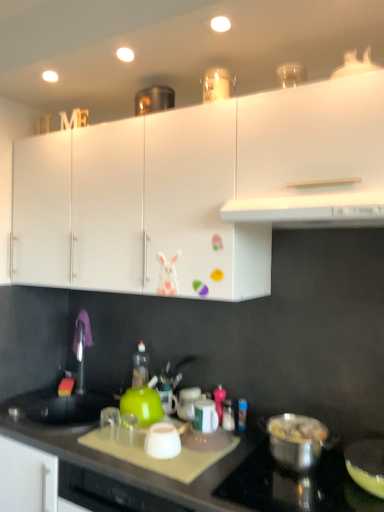
Image resolution: width=384 pixels, height=512 pixels. What do you see at coordinates (162, 441) in the screenshot?
I see `white glossy cup at center, which appears as the second kitchen appliance when viewed from the left` at bounding box center [162, 441].

At what (x,y) coordinates should I click in order to perform the action: click on stainless steel pot at lower right. Please return your answer as a coordinate pair (x, y). Image resolution: width=384 pixels, height=512 pixels. Looking at the image, I should click on (295, 485).

Describe the element at coordinates (198, 209) in the screenshot. The image size is (384, 512). I see `white matte cabinet at center, placed as the 2th cabinetry when sorted from right to left` at that location.

Measure the distance between point (192,389) and camera.

The distance of point (192,389) from camera is 6.27 feet.

What do you see at coordinates (188, 403) in the screenshot? This screenshot has height=512, width=384. I see `white glossy jar at center` at bounding box center [188, 403].

Measure the distance between point (209, 405) and camera.

Point (209, 405) is 1.65 meters away from camera.

This screenshot has height=512, width=384. Describe the element at coordinates (205, 416) in the screenshot. I see `white glossy cups at center, which appears as the third kitchen appliance when viewed from the left` at that location.

In order to click on white matte cabinet at upper center, arranged as the 1th cabinetry when viewed from the right in this screenshot , I will do `click(312, 138)`.

The height and width of the screenshot is (512, 384). What do you see at coordinates (296, 441) in the screenshot? I see `shiny metallic pot at lower right, which is the first kitchen appliance from right to left` at bounding box center [296, 441].

Identify the location of green matte kettle at center, arranged as the first kitchen appliance when viewed from the left. This screenshot has height=512, width=384. (142, 405).

From a real-world perspective, does white plastic exhaust hood at upper center stand above white matte cabinet at upper center, arranged as the third cabinetry when viewed from the left?

Actually, white plastic exhaust hood at upper center is physically below white matte cabinet at upper center, arranged as the third cabinetry when viewed from the left, in the real world.

Does white plastic exhaust hood at upper center have a greater width compared to white matte cabinet at upper center, arranged as the third cabinetry when viewed from the left?

Yes, white plastic exhaust hood at upper center is wider than white matte cabinet at upper center, arranged as the third cabinetry when viewed from the left.

Which is more to the right, white plastic exhaust hood at upper center or white matte cabinet at upper center, arranged as the 1th cabinetry when viewed from the right?

Positioned to the right is white matte cabinet at upper center, arranged as the 1th cabinetry when viewed from the right.

Find the location of `cabinetry above the white glossy cabinet at upper center, which is the 1th cabinetry from left to right (from the image's perspective)`. cabinetry above the white glossy cabinet at upper center, which is the 1th cabinetry from left to right (from the image's perspective) is located at coordinates (312, 138).

Is white matte cabinet at upper center, arranged as the 1th cabinetry when viewed from the right, spatially inside white glossy cabinet at upper center, arranged as the third cabinetry when viewed from the right, or outside of it?

white matte cabinet at upper center, arranged as the 1th cabinetry when viewed from the right, cannot be found inside white glossy cabinet at upper center, arranged as the third cabinetry when viewed from the right.

From a real-world perspective, between white matte cabinet at upper center, arranged as the 1th cabinetry when viewed from the right, and white glossy cabinet at upper center, which is the 1th cabinetry from left to right, who is vertically lower?

white glossy cabinet at upper center, which is the 1th cabinetry from left to right, from a real-world perspective.

From the image's perspective, is white matte cabinet at upper center, arranged as the 1th cabinetry when viewed from the right, on white glossy cabinet at upper center, arranged as the third cabinetry when viewed from the right?

Correct, white matte cabinet at upper center, arranged as the 1th cabinetry when viewed from the right, appears higher than white glossy cabinet at upper center, arranged as the third cabinetry when viewed from the right, in the image.

From a real-world perspective, which object rests below the other?

white glossy cups at center, which appears as the third kitchen appliance when viewed from the left, is physically lower.

Considering the relative sizes of white matte cabinet at upper center, arranged as the third cabinetry when viewed from the left, and white glossy cups at center, the second kitchen appliance positioned from the right, in the image provided, is white matte cabinet at upper center, arranged as the third cabinetry when viewed from the left, taller than white glossy cups at center, the second kitchen appliance positioned from the right,?

Yes.

Is white matte cabinet at upper center, arranged as the 1th cabinetry when viewed from the right, oriented away from white glossy cups at center, the second kitchen appliance positioned from the right?

white matte cabinet at upper center, arranged as the 1th cabinetry when viewed from the right, is not turned away from white glossy cups at center, the second kitchen appliance positioned from the right.

Is white glossy cups at center, which appears as the third kitchen appliance when viewed from the left, inside white matte cabinet at upper center, arranged as the third cabinetry when viewed from the left?

That's incorrect, white glossy cups at center, which appears as the third kitchen appliance when viewed from the left, is not inside white matte cabinet at upper center, arranged as the third cabinetry when viewed from the left.

Is shiny metallic pot at lower right, acting as the 4th kitchen appliance starting from the left, situated inside white matte cabinet at center, placed as the 2th cabinetry when sorted from right to left, or outside?

shiny metallic pot at lower right, acting as the 4th kitchen appliance starting from the left, is located beyond the bounds of white matte cabinet at center, placed as the 2th cabinetry when sorted from right to left.

How many degrees apart are the facing directions of shiny metallic pot at lower right, acting as the 4th kitchen appliance starting from the left, and white matte cabinet at center, placed as the 2th cabinetry when sorted from right to left?

They differ by 1.37 degrees in their facing directions.

Is shiny metallic pot at lower right, acting as the 4th kitchen appliance starting from the left, wider or thinner than white matte cabinet at center, which is counted as the second cabinetry, starting from the left?

shiny metallic pot at lower right, acting as the 4th kitchen appliance starting from the left, is thinner than white matte cabinet at center, which is counted as the second cabinetry, starting from the left.

Is shiny metallic pot at lower right, acting as the 4th kitchen appliance starting from the left, not close to white matte cabinet at center, placed as the 2th cabinetry when sorted from right to left?

That's not correct — shiny metallic pot at lower right, acting as the 4th kitchen appliance starting from the left, is a little close to white matte cabinet at center, placed as the 2th cabinetry when sorted from right to left.

In the scene shown: From a real-world perspective, which object rests below the other?

green matte kettle at center, the fourth kitchen appliance when ordered from right to left, is physically lower.

Is point (21, 271) more distant than point (145, 425)?

Yes, point (21, 271) is farther from viewer.

Between white glossy cabinet at upper center, which is the 1th cabinetry from left to right, and green matte kettle at center, arranged as the first kitchen appliance when viewed from the left, which one has more height?

white glossy cabinet at upper center, which is the 1th cabinetry from left to right.

Does white glossy cabinet at upper center, arranged as the third cabinetry when viewed from the right, touch green matte kettle at center, the fourth kitchen appliance when ordered from right to left?

They are not placed beside each other.

What are the coordinates of `cabinetry that is the 2nd object to the left of the shiny metallic pot at lower right, acting as the 4th kitchen appliance starting from the left, starting at the anchor` in the screenshot? It's located at (80, 208).

Is point (295, 441) more distant than point (70, 196)?

No, (295, 441) is closer to viewer.

Is white glossy cabinet at upper center, arranged as the third cabinetry when viewed from the right, at the back of shiny metallic pot at lower right, which is the first kitchen appliance from right to left?

No, white glossy cabinet at upper center, arranged as the third cabinetry when viewed from the right, is not at the back of shiny metallic pot at lower right, which is the first kitchen appliance from right to left.

Can you tell me how much shiny metallic pot at lower right, which is the first kitchen appliance from right to left, and white glossy cabinet at upper center, which is the 1th cabinetry from left to right, differ in facing direction?

The angular difference between shiny metallic pot at lower right, which is the first kitchen appliance from right to left, and white glossy cabinet at upper center, which is the 1th cabinetry from left to right, is 1.37 degrees.

Considering the sizes of objects stainless steel pot at lower right and white matte cabinet at upper center, arranged as the 1th cabinetry when viewed from the right, in the image provided, who is wider, stainless steel pot at lower right or white matte cabinet at upper center, arranged as the 1th cabinetry when viewed from the right,?

stainless steel pot at lower right.

Who is taller, stainless steel pot at lower right or white matte cabinet at upper center, arranged as the 1th cabinetry when viewed from the right?

white matte cabinet at upper center, arranged as the 1th cabinetry when viewed from the right, is taller.

Does stainless steel pot at lower right have a larger size compared to white matte cabinet at upper center, arranged as the 1th cabinetry when viewed from the right?

Incorrect, stainless steel pot at lower right is not larger than white matte cabinet at upper center, arranged as the 1th cabinetry when viewed from the right.

Is stainless steel pot at lower right closer to the viewer compared to white matte cabinet at upper center, arranged as the third cabinetry when viewed from the left?

Yes, stainless steel pot at lower right is closer to the camera.

From a real-world perspective, count 3rd cabinetrys upward from the white plastic exhaust hood at upper center and point to it. Please provide its 2D coordinates.

[(312, 138)]

Which cabinetry is the 2nd one when counting from the left side of the white matte cabinet at upper center, arranged as the third cabinetry when viewed from the left? Please provide its 2D coordinates.

[(80, 208)]

Which object lies further to the anchor point white matte cabinet at center, which is counted as the second cabinetry, starting from the left, white matte cabinet at upper center, arranged as the 1th cabinetry when viewed from the right, or black matte countertop at lower center?

Among the two, black matte countertop at lower center is located further to white matte cabinet at center, which is counted as the second cabinetry, starting from the left.

Estimate the real-world distances between objects in this image. Which object is closer to shiny metallic pot at lower right, acting as the 4th kitchen appliance starting from the left, white plastic exhaust hood at upper center or white matte cabinet at center, which is counted as the second cabinetry, starting from the left?

The object closer to shiny metallic pot at lower right, acting as the 4th kitchen appliance starting from the left, is white matte cabinet at center, which is counted as the second cabinetry, starting from the left.

Based on the photo, from the image, which object appears to be nearer to shiny metallic pot at lower right, acting as the 4th kitchen appliance starting from the left, white matte cabinet at upper center, arranged as the third cabinetry when viewed from the left, or white glossy cabinet at upper center, which is the 1th cabinetry from left to right?

The object closer to shiny metallic pot at lower right, acting as the 4th kitchen appliance starting from the left, is white matte cabinet at upper center, arranged as the third cabinetry when viewed from the left.

When comparing their distances from stainless steel pot at lower right, does white glossy cup at center, which appears as the second kitchen appliance when viewed from the left, or white plastic exhaust hood at upper center seem closer?

white glossy cup at center, which appears as the second kitchen appliance when viewed from the left, is closer to stainless steel pot at lower right.

Which object lies further to the anchor point black matte countertop at lower center, white matte cabinet at center, which is counted as the second cabinetry, starting from the left, or white glossy cabinet at upper center, arranged as the third cabinetry when viewed from the right?

Among the two, white glossy cabinet at upper center, arranged as the third cabinetry when viewed from the right, is located further to black matte countertop at lower center.

Looking at the image, which one is located closer to white glossy cups at center, the second kitchen appliance positioned from the right, green matte kettle at center, arranged as the first kitchen appliance when viewed from the left, or white glossy cup at center, marked as the 3th kitchen appliance in a right-to-left arrangement?

The object closer to white glossy cups at center, the second kitchen appliance positioned from the right, is white glossy cup at center, marked as the 3th kitchen appliance in a right-to-left arrangement.

Estimate the real-world distances between objects in this image. Which object is further from white matte cabinet at upper center, arranged as the third cabinetry when viewed from the left, white glossy cup at center, which appears as the second kitchen appliance when viewed from the left, or stainless steel pot at lower right?

Among the two, white glossy cup at center, which appears as the second kitchen appliance when viewed from the left, is located further to white matte cabinet at upper center, arranged as the third cabinetry when viewed from the left.

Which object lies further to the anchor point white plastic exhaust hood at upper center, shiny metallic pot at lower right, which is the first kitchen appliance from right to left, or white matte cabinet at upper center, arranged as the third cabinetry when viewed from the left?

shiny metallic pot at lower right, which is the first kitchen appliance from right to left.

You are a GUI agent. You are given a task and a screenshot of the screen. Output one action in this format:
    pyautogui.click(x=<x>, y=<y>)
    Task: Click on the kitchen appliance that lies between white matte cabinet at upper center, arranged as the 1th cabinetry when viewed from the right, and green matte kettle at center, the fourth kitchen appliance when ordered from right to left, from top to bottom
    
    Given the screenshot: What is the action you would take?
    point(205,416)

Identify the location of appliance between white matte cabinet at center, placed as the 2th cabinetry when sorted from right to left, and stainless steel pot at lower right, in the vertical direction. The height and width of the screenshot is (512, 384). (188, 403).

Where is `appliance that lies between white plastic exhaust hood at upper center and shiny metallic pot at lower right, which is the first kitchen appliance from right to left, from top to bottom`? The height and width of the screenshot is (512, 384). appliance that lies between white plastic exhaust hood at upper center and shiny metallic pot at lower right, which is the first kitchen appliance from right to left, from top to bottom is located at coordinates (188, 403).

Locate an element on the screen. The width and height of the screenshot is (384, 512). appliance that lies between white matte cabinet at center, placed as the 2th cabinetry when sorted from right to left, and black matte countertop at lower center from top to bottom is located at coordinates (188, 403).